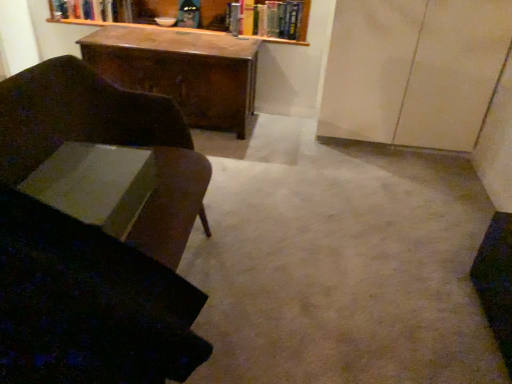
Locate an element on the screen. hardcover books at upper center, which appears as the second book when ordered from the bottom is located at coordinates coord(274,18).

Describe the element at coordinates (79, 113) in the screenshot. I see `velvet dark brown chair at left` at that location.

The height and width of the screenshot is (384, 512). Describe the element at coordinates (181, 71) in the screenshot. I see `wooden desk at center` at that location.

This screenshot has width=512, height=384. What do you see at coordinates (88, 304) in the screenshot? I see `velvet dark brown swivel chair at left` at bounding box center [88, 304].

Where is `hardcover books at upper center, which appears as the second book when viewed from the front`? hardcover books at upper center, which appears as the second book when viewed from the front is located at coordinates (274, 18).

Is matte beige cabinet at right inside or outside of hardcover books at upper center, the first book viewed from the right?

matte beige cabinet at right is spatially situated outside hardcover books at upper center, the first book viewed from the right.

Is matte beige cabinet at right facing towards hardcover books at upper center, the first book viewed from the right?

No, matte beige cabinet at right is not oriented towards hardcover books at upper center, the first book viewed from the right.

From the picture: Is matte beige cabinet at right far away from hardcover books at upper center, which appears as the 2th book when viewed from the back?

No, matte beige cabinet at right is not far from hardcover books at upper center, which appears as the 2th book when viewed from the back.

From the image's perspective, between matte beige cabinet at right and hardcover books at upper center, which appears as the 3th book when viewed from the left, who is located below?

matte beige cabinet at right appears lower in the image.

How much distance is there between hardcover book at upper center, the 3th book from the right, and hardcover books at upper center, which appears as the second book when ordered from the bottom?

hardcover book at upper center, the 3th book from the right, and hardcover books at upper center, which appears as the second book when ordered from the bottom, are 1.12 meters apart.

Is hardcover book at upper center, marked as the 1th book in a top-to-bottom arrangement, far from hardcover books at upper center, which appears as the 2th book when viewed from the back?

That's right, there is a large distance between hardcover book at upper center, marked as the 1th book in a top-to-bottom arrangement, and hardcover books at upper center, which appears as the 2th book when viewed from the back.

Considering the relative sizes of hardcover book at upper center, which appears as the third book when viewed from the front, and hardcover books at upper center, which appears as the 3th book when viewed from the left, in the image provided, is hardcover book at upper center, which appears as the third book when viewed from the front, smaller than hardcover books at upper center, which appears as the 3th book when viewed from the left,?

No.

In the scene shown: Considering the relative sizes of hardcover book at upper center, which appears as the third book when viewed from the front, and hardcover books at upper center, which appears as the second book when ordered from the bottom, in the image provided, is hardcover book at upper center, which appears as the third book when viewed from the front, taller than hardcover books at upper center, which appears as the second book when ordered from the bottom,?

In fact, hardcover book at upper center, which appears as the third book when viewed from the front, may be shorter than hardcover books at upper center, which appears as the second book when ordered from the bottom.

Can you confirm if velvet dark brown swivel chair at left is bigger than hardcover books at upper center, which appears as the 3th book when viewed from the left?

Yes.

Which of these two, velvet dark brown swivel chair at left or hardcover books at upper center, which appears as the second book when viewed from the front, is wider?

Wider between the two is velvet dark brown swivel chair at left.

From the picture: How far apart are velvet dark brown swivel chair at left and hardcover books at upper center, the first book viewed from the right?

A distance of 2.36 meters exists between velvet dark brown swivel chair at left and hardcover books at upper center, the first book viewed from the right.

Looking at this image, from the image's perspective, is velvet dark brown swivel chair at left beneath hardcover books at upper center, the first book viewed from the right?

Yes, from the image's perspective, velvet dark brown swivel chair at left is beneath hardcover books at upper center, the first book viewed from the right.

Is hardcover book at upper center, the 1th book in the left-to-right sequence, directly adjacent to velvet dark brown chair at left?

hardcover book at upper center, the 1th book in the left-to-right sequence, is not next to velvet dark brown chair at left, and they're not touching.

Is hardcover book at upper center, the 1th book viewed from the back, located outside velvet dark brown chair at left?

hardcover book at upper center, the 1th book viewed from the back, is positioned outside velvet dark brown chair at left.

Considering the relative positions of hardcover book at upper center, the 1th book viewed from the back, and velvet dark brown chair at left in the image provided, is hardcover book at upper center, the 1th book viewed from the back, to the left of velvet dark brown chair at left from the viewer's perspective?

Yes.

Measure the distance from hardcover book at upper center, the 1th book viewed from the back, to velvet dark brown chair at left.

hardcover book at upper center, the 1th book viewed from the back, is 6.25 feet away from velvet dark brown chair at left.

Find the location of a particular element. Image resolution: width=512 pixels, height=384 pixels. desk in front of the hardcover books at upper center, which appears as the second book when ordered from the bottom is located at coordinates (181, 71).

From a real-world perspective, relative to wooden desk at center, is hardcover books at upper center, which appears as the second book when viewed from the front, vertically above or below?

hardcover books at upper center, which appears as the second book when viewed from the front, is situated higher than wooden desk at center in the real world.

Is hardcover books at upper center, which appears as the 3th book when viewed from the left, completely or partially outside of wooden desk at center?

Absolutely, hardcover books at upper center, which appears as the 3th book when viewed from the left, is external to wooden desk at center.

From the image's perspective, is hardcover books at upper center, which is counted as the second book, starting from the top, located above wooden desk at center?

Yes, from the image's perspective, hardcover books at upper center, which is counted as the second book, starting from the top, is on top of wooden desk at center.

Identify the location of swivel chair below the hardcover book at upper center, the 1th book viewed from the back (from the image's perspective). The height and width of the screenshot is (384, 512). (88, 304).

Are hardcover book at upper center, which appears as the third book when viewed from the front, and velvet dark brown swivel chair at left making contact?

hardcover book at upper center, which appears as the third book when viewed from the front, is not next to velvet dark brown swivel chair at left, and they're not touching.

From a real-world perspective, who is located higher, hardcover book at upper center, arranged as the third book when ordered from the bottom, or velvet dark brown swivel chair at left?

From a 3D spatial view, hardcover book at upper center, arranged as the third book when ordered from the bottom, is above.

Is hardcover book at upper center, marked as the 1th book in a top-to-bottom arrangement, oriented towards velvet dark brown swivel chair at left?

Yes, hardcover book at upper center, marked as the 1th book in a top-to-bottom arrangement, is oriented towards velvet dark brown swivel chair at left.

Is wooden desk at center far away from velvet dark brown swivel chair at left?

Yes, wooden desk at center is far from velvet dark brown swivel chair at left.

Could velvet dark brown swivel chair at left be considered to be inside wooden desk at center?

No.

Based on the photo, is wooden desk at center positioned with its back to velvet dark brown swivel chair at left?

No, velvet dark brown swivel chair at left is not at the back of wooden desk at center.

From the image's perspective, relative to velvet dark brown swivel chair at left, is wooden desk at center above or below?

Clearly, from the image's perspective, wooden desk at center is above velvet dark brown swivel chair at left.

Where is `book that is the 1st object located above the matte beige cabinet at right (from the image's perspective)`? book that is the 1st object located above the matte beige cabinet at right (from the image's perspective) is located at coordinates (274, 18).

This screenshot has height=384, width=512. In order to click on book located behind the hardcover books at upper center, which is counted as the second book, starting from the top in this screenshot , I will do `click(92, 10)`.

Based on their spatial positions, is velvet dark brown chair at left or hardcover books at upper center, which is counted as the second book, starting from the top, further from white paper at lower left, the 3th book viewed from the top?

hardcover books at upper center, which is counted as the second book, starting from the top, is further to white paper at lower left, the 3th book viewed from the top.

Considering their positions, is hardcover books at upper center, which appears as the 3th book when viewed from the left, positioned closer to velvet dark brown swivel chair at left than hardcover book at upper center, marked as the 1th book in a top-to-bottom arrangement?

hardcover books at upper center, which appears as the 3th book when viewed from the left, lies closer to velvet dark brown swivel chair at left than the other object.

When comparing their distances from hardcover books at upper center, which appears as the 2th book when viewed from the back, does hardcover book at upper center, arranged as the third book when ordered from the bottom, or wooden desk at center seem closer?

Based on the image, wooden desk at center appears to be nearer to hardcover books at upper center, which appears as the 2th book when viewed from the back.

From the image, which object appears to be nearer to velvet dark brown swivel chair at left, white paper at lower left, the 1th book positioned from the front, or hardcover book at upper center, marked as the 1th book in a top-to-bottom arrangement?

The object closer to velvet dark brown swivel chair at left is white paper at lower left, the 1th book positioned from the front.

From the image, which object appears to be nearer to velvet dark brown swivel chair at left, matte beige cabinet at right or velvet dark brown chair at left?

velvet dark brown chair at left lies closer to velvet dark brown swivel chair at left than the other object.

Looking at this image, based on their spatial positions, is hardcover books at upper center, which appears as the second book when ordered from the bottom, or wooden desk at center closer to velvet dark brown chair at left?

The object closer to velvet dark brown chair at left is wooden desk at center.

Looking at the image, which one is located closer to velvet dark brown chair at left, white paper at lower left, the 3th book viewed from the top, or velvet dark brown swivel chair at left?

white paper at lower left, the 3th book viewed from the top, is closer to velvet dark brown chair at left.

Looking at the image, which one is located further to hardcover book at upper center, the 1th book viewed from the back, velvet dark brown swivel chair at left or white paper at lower left, the 2th book when ordered from right to left?

velvet dark brown swivel chair at left.

Locate an element on the screen. This screenshot has height=384, width=512. desk between velvet dark brown chair at left and hardcover books at upper center, which appears as the second book when viewed from the front, along the z-axis is located at coordinates click(181, 71).

Find the location of `desk positioned between velvet dark brown swivel chair at left and hardcover books at upper center, which appears as the 3th book when viewed from the left, from near to far`. desk positioned between velvet dark brown swivel chair at left and hardcover books at upper center, which appears as the 3th book when viewed from the left, from near to far is located at coordinates (181, 71).

In order to click on book between velvet dark brown swivel chair at left and matte beige cabinet at right in the front-back direction in this screenshot , I will do `click(96, 184)`.

Where is `glass door between velvet dark brown chair at left and hardcover book at upper center, marked as the 1th book in a top-to-bottom arrangement, from front to back`? This screenshot has width=512, height=384. glass door between velvet dark brown chair at left and hardcover book at upper center, marked as the 1th book in a top-to-bottom arrangement, from front to back is located at coordinates (413, 70).